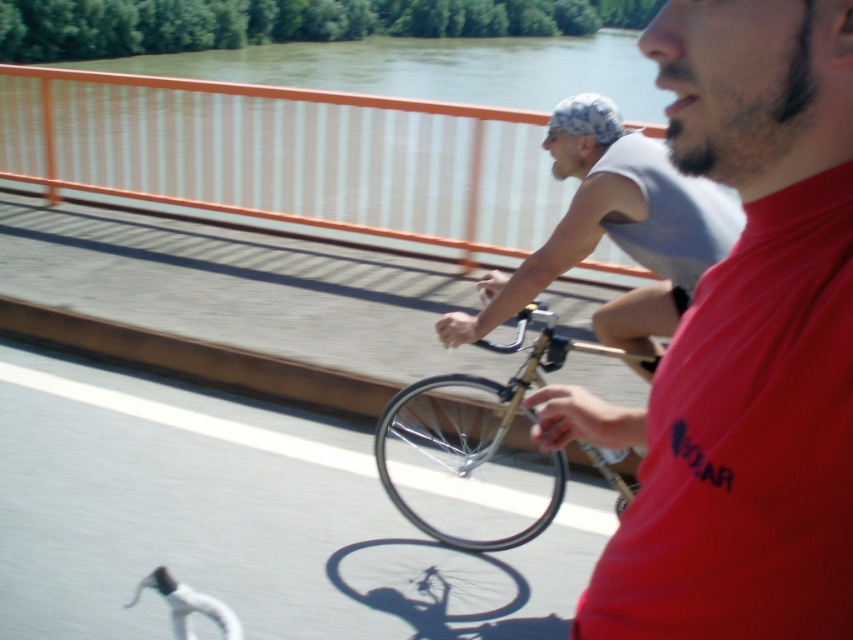
Can you confirm if gold metallic bicycle at center is positioned to the right of blue fabric helmet at upper center?

No, gold metallic bicycle at center is not to the right of blue fabric helmet at upper center.

Which is behind, point (457, 496) or point (577, 109)?

Positioned behind is point (457, 496).

Where is `gold metallic bicycle at center`? gold metallic bicycle at center is located at coordinates [477, 448].

This screenshot has width=853, height=640. Find the location of `gold metallic bicycle at center`. gold metallic bicycle at center is located at coordinates point(477,448).

Which is more to the left, gold metallic bicycle at center or shiny metallic bicycle wheel at center?

shiny metallic bicycle wheel at center

Find the location of a particular element. The width and height of the screenshot is (853, 640). gold metallic bicycle at center is located at coordinates (477, 448).

Between matte red t-shirt at center and gold metallic bicycle at center, which one appears on the left side from the viewer's perspective?

Positioned to the left is gold metallic bicycle at center.

Who is higher up, matte red t-shirt at center or gold metallic bicycle at center?

matte red t-shirt at center is above.

Describe the element at coordinates (743, 348) in the screenshot. I see `matte red t-shirt at center` at that location.

The image size is (853, 640). In order to click on matte red t-shirt at center in this screenshot , I will do `click(743, 348)`.